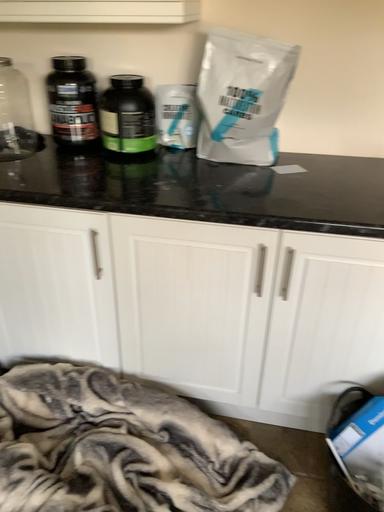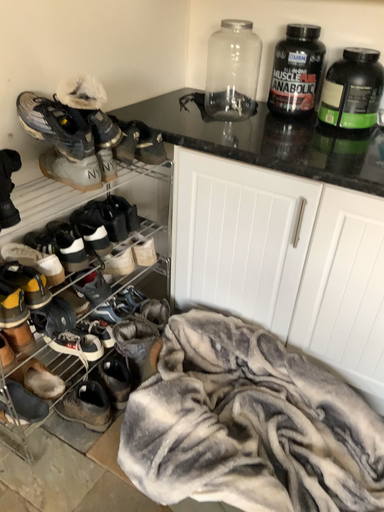
Question: How did the camera likely rotate when shooting the video?

Choices:
 (A) rotated left
 (B) rotated right

Answer: (A)